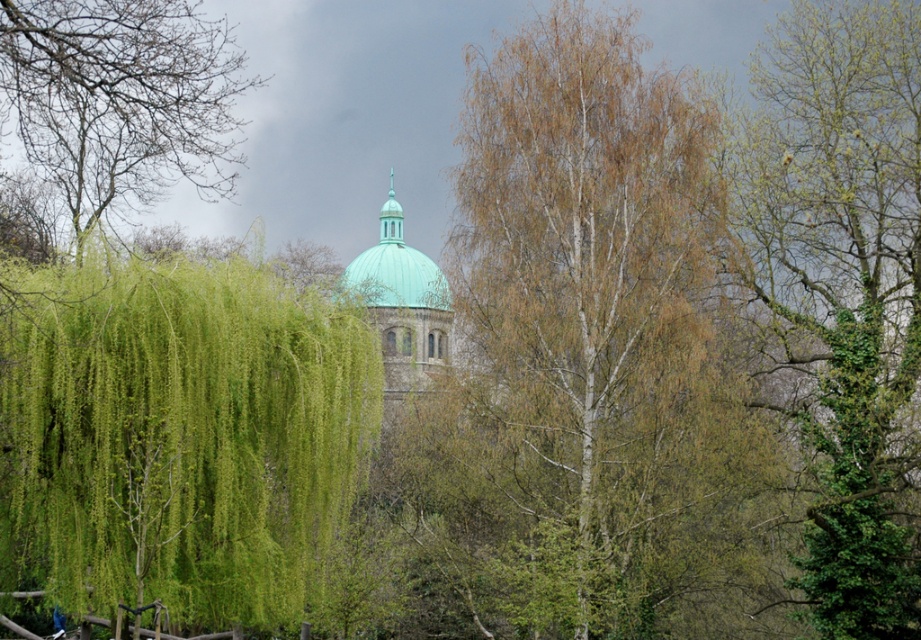
Does green leafy willow at left have a lesser width compared to green leafy tree at right?

No.

Based on the photo, which is more to the right, green leafy willow at left or green leafy tree at right?

From the viewer's perspective, green leafy tree at right appears more on the right side.

Is point (185, 589) more distant than point (838, 624)?

No.

The width and height of the screenshot is (921, 640). I want to click on green leafy willow at left, so click(176, 435).

What do you see at coordinates (581, 362) in the screenshot? This screenshot has width=921, height=640. I see `smooth white bark tree at center` at bounding box center [581, 362].

Can you confirm if smooth white bark tree at center is bigger than green leafy tree at right?

Yes.

Is point (579, 460) positioned before point (838, 289)?

That is True.

Locate an element on the screen. The image size is (921, 640). smooth white bark tree at center is located at coordinates (581, 362).

Between green leafy tree at right and green matte dome at center, which one has more height?

With more height is green leafy tree at right.

Is green leafy tree at right below green matte dome at center?

Yes, green leafy tree at right is below green matte dome at center.

The width and height of the screenshot is (921, 640). Describe the element at coordinates (840, 294) in the screenshot. I see `green leafy tree at right` at that location.

Identify the location of green leafy tree at right. (840, 294).